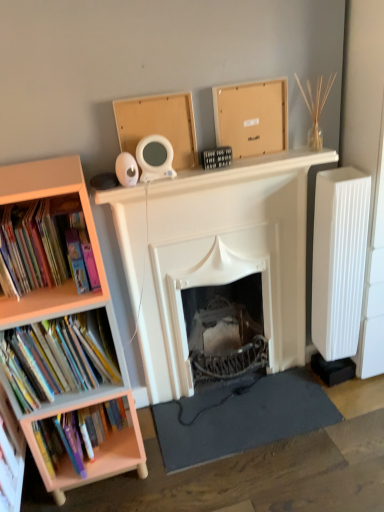
Question: Should I look upward or downward to see matte cardboard bookshelf at left, acting as the first book starting from the top?

Choices:
 (A) up
 (B) down

Answer: (A)

Question: From the image's perspective, would you say dark gray rubber mat at lower center is shown under matte cardboard box at upper center, arranged as the 1th cardboard box when viewed from the right?

Choices:
 (A) no
 (B) yes

Answer: (B)

Question: Does dark gray rubber mat at lower center have a smaller size compared to matte cardboard box at upper center, arranged as the 1th cardboard box when viewed from the right?

Choices:
 (A) yes
 (B) no

Answer: (B)

Question: Is dark gray rubber mat at lower center next to matte cardboard box at upper center, the 2th cardboard box viewed from the left?

Choices:
 (A) no
 (B) yes

Answer: (A)

Question: From the image's perspective, does dark gray rubber mat at lower center appear higher than matte cardboard box at upper center, the 2th cardboard box viewed from the left?

Choices:
 (A) no
 (B) yes

Answer: (A)

Question: Is dark gray rubber mat at lower center further to the viewer compared to matte cardboard box at upper center, arranged as the 1th cardboard box when viewed from the right?

Choices:
 (A) yes
 (B) no

Answer: (A)

Question: Is dark gray rubber mat at lower center outside of matte cardboard box at upper center, arranged as the 1th cardboard box when viewed from the right?

Choices:
 (A) no
 (B) yes

Answer: (B)

Question: From the image's perspective, is hardcover books at left, which is counted as the 1th book, starting from the bottom, under hardcover books at left, the second book when ordered from top to bottom?

Choices:
 (A) yes
 (B) no

Answer: (A)

Question: Is hardcover books at left, which is counted as the 1th book, starting from the bottom, to the right of hardcover books at left, the second book when ordered from top to bottom, from the viewer's perspective?

Choices:
 (A) yes
 (B) no

Answer: (A)

Question: Is hardcover books at left, the 3th book in the top-to-bottom sequence, placed right next to hardcover books at left, the second book when ordered from top to bottom?

Choices:
 (A) no
 (B) yes

Answer: (A)

Question: Is hardcover books at left, the 3th book in the top-to-bottom sequence, bigger than hardcover books at left, the second book when ordered from top to bottom?

Choices:
 (A) yes
 (B) no

Answer: (B)

Question: Is there a large distance between hardcover books at left, the 3th book in the top-to-bottom sequence, and hardcover books at left, the second book when ordered from top to bottom?

Choices:
 (A) yes
 (B) no

Answer: (B)

Question: Is hardcover books at left, which is counted as the 1th book, starting from the bottom, completely or partially outside of hardcover books at left, the second book from the bottom?

Choices:
 (A) yes
 (B) no

Answer: (A)

Question: Can you see hardcover books at left, the second book when ordered from top to bottom, touching matte cardboard box at upper center, the 2th cardboard box viewed from the left?

Choices:
 (A) no
 (B) yes

Answer: (A)